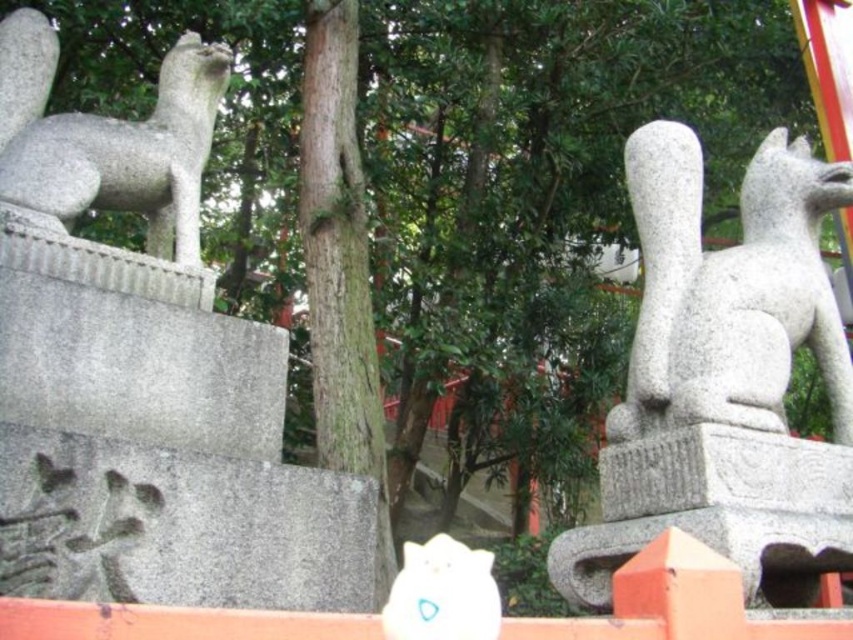
Between gray stone statue at left and white plush toy at center, which one appears on the left side from the viewer's perspective?

gray stone statue at left is more to the left.

Is point (195, 109) farther from camera compared to point (497, 604)?

Yes, it is behind point (497, 604).

Where is `gray stone statue at left`? The height and width of the screenshot is (640, 853). gray stone statue at left is located at coordinates (109, 138).

Can you confirm if granite statue at right is positioned above gray stone statue at left?

No, granite statue at right is not above gray stone statue at left.

Can you confirm if granite statue at right is positioned to the right of gray stone statue at left?

Correct, you'll find granite statue at right to the right of gray stone statue at left.

Where is `granite statue at right`? The height and width of the screenshot is (640, 853). granite statue at right is located at coordinates pos(724,378).

Which is more to the right, granite statue at right or white plush toy at center?

granite statue at right is more to the right.

Who is more distant from viewer, (741, 371) or (393, 616)?

Point (741, 371)

Does point (759, 458) come closer to viewer compared to point (450, 628)?

No.

At what (x,y) coordinates should I click in order to perform the action: click on granite statue at right. Please return your answer as a coordinate pair (x, y). Looking at the image, I should click on (724, 378).